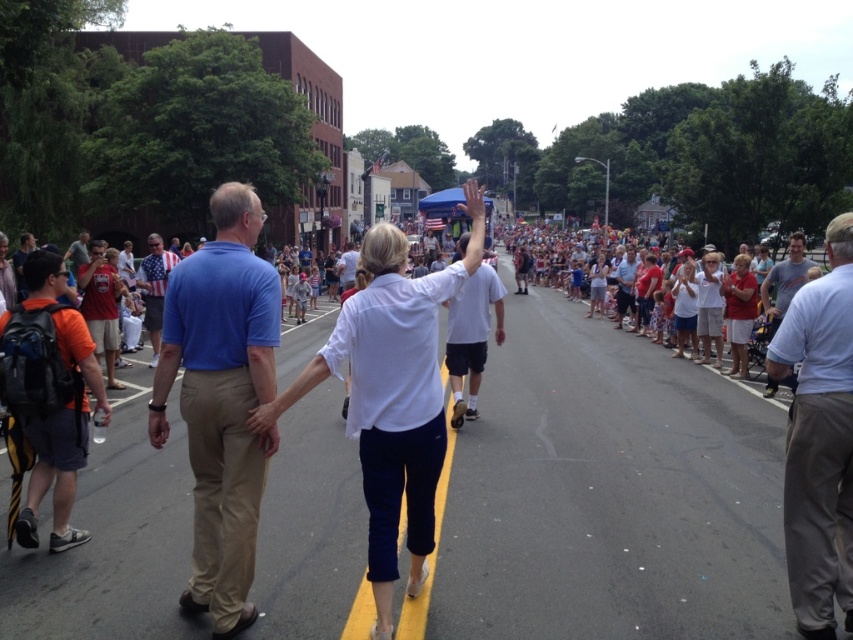
Who is more distant from viewer, (393,392) or (820,445)?

The point (820,445) is more distant.

Between point (410, 381) and point (798, 410), which one is positioned behind?

Positioned behind is point (798, 410).

Locate an element on the screen. This screenshot has height=640, width=853. white cotton shirt at center is located at coordinates (392, 396).

Does point (155, 416) come closer to viewer compared to point (833, 380)?

No, (155, 416) is behind (833, 380).

Image resolution: width=853 pixels, height=640 pixels. What do you see at coordinates (221, 400) in the screenshot? I see `blue cotton shirt at center` at bounding box center [221, 400].

The height and width of the screenshot is (640, 853). I want to click on blue cotton shirt at center, so click(x=221, y=400).

Which is more to the left, gray cotton pants at right or matte red t-shirt at left?

matte red t-shirt at left

Which is behind, point (815, 348) or point (119, 292)?

The point (119, 292) is behind.

Between point (804, 467) and point (108, 321), which one is positioned in front?

Positioned in front is point (804, 467).

Where is `gray cotton pants at right`? The height and width of the screenshot is (640, 853). gray cotton pants at right is located at coordinates (819, 440).